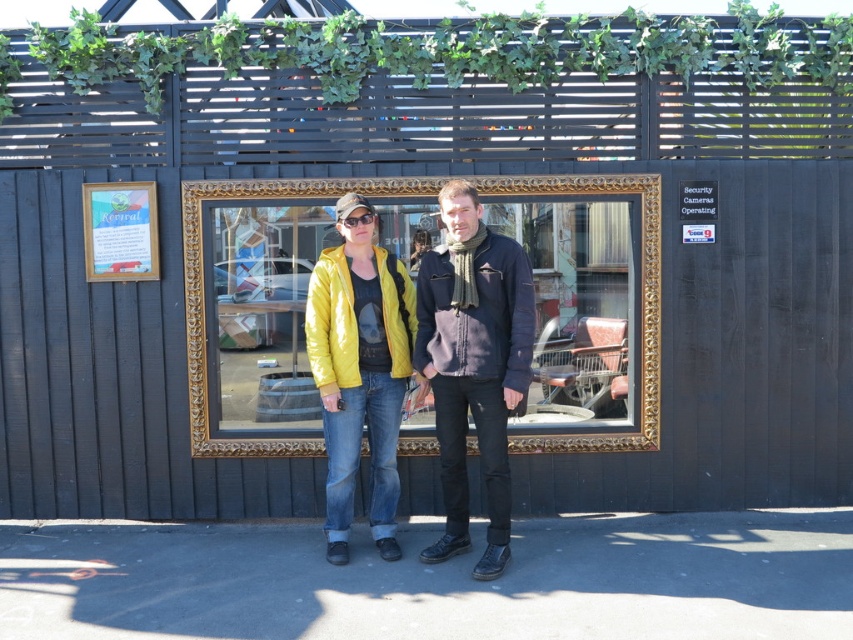
You are a window cleaner who needs to clean the large rectangular window with an ornate gold border. You have a cleaning cloth that can cover an area equal to the size of the wooden sign at upper left. Can you clean the entire glossy yellow jacket at center with one cloth? Please explain your reasoning.

The glossy yellow jacket at center is bigger than the wooden sign at upper left. Since the cloth can only cover the area of the wooden sign at upper left, it is not large enough to clean the entire glossy yellow jacket at center in one go.